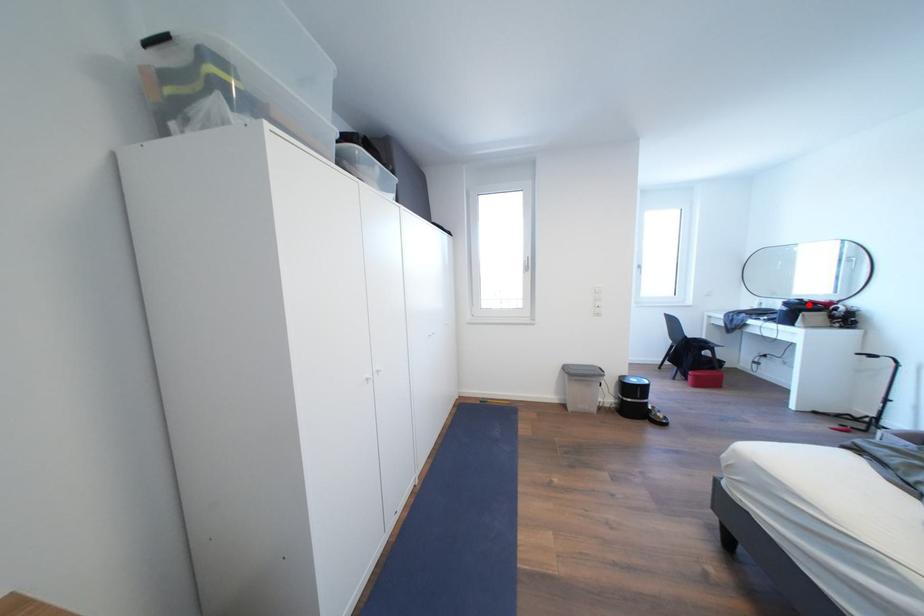
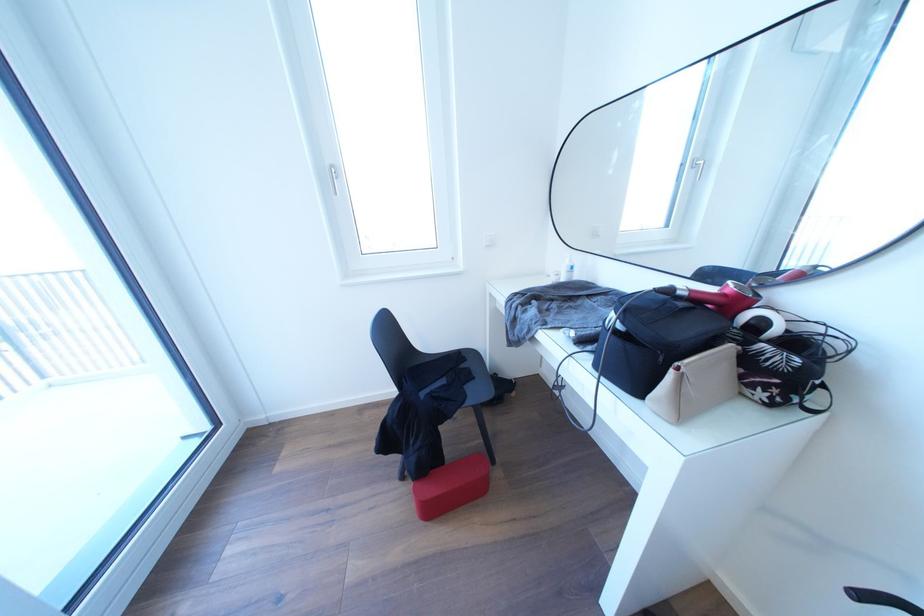
Question: I am providing you with two images of the same scene from different viewpoints. A red point is marked on the first image. Can you still see the location of the red point in image 2?

Choices:
 (A) Yes
 (B) No

Answer: (A)